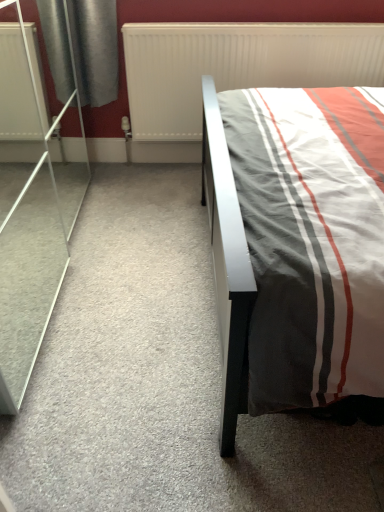
This screenshot has width=384, height=512. I want to click on vacant space underneath transparent glass screen door at left (from a real-world perspective), so click(x=28, y=252).